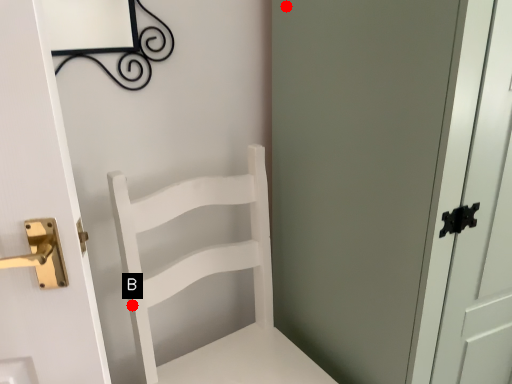
Question: Two points are circled on the image, labeled by A and B beside each circle. Which point is closer to the camera taking this photo?

Choices:
 (A) A is closer
 (B) B is closer

Answer: (B)